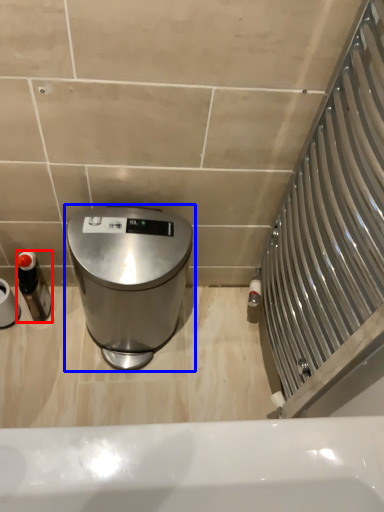
Question: Which object appears closest to the camera in this image, bottle (highlighted by a red box) or waste container (highlighted by a blue box)?

Choices:
 (A) bottle
 (B) waste container

Answer: (B)